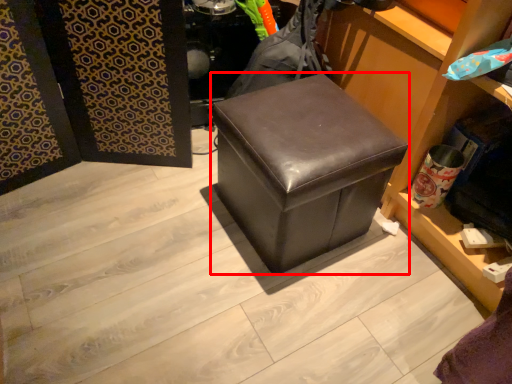
Question: From the image's perspective, where is furniture (annotated by the red box) located in relation to square in the image?

Choices:
 (A) above
 (B) below

Answer: (A)